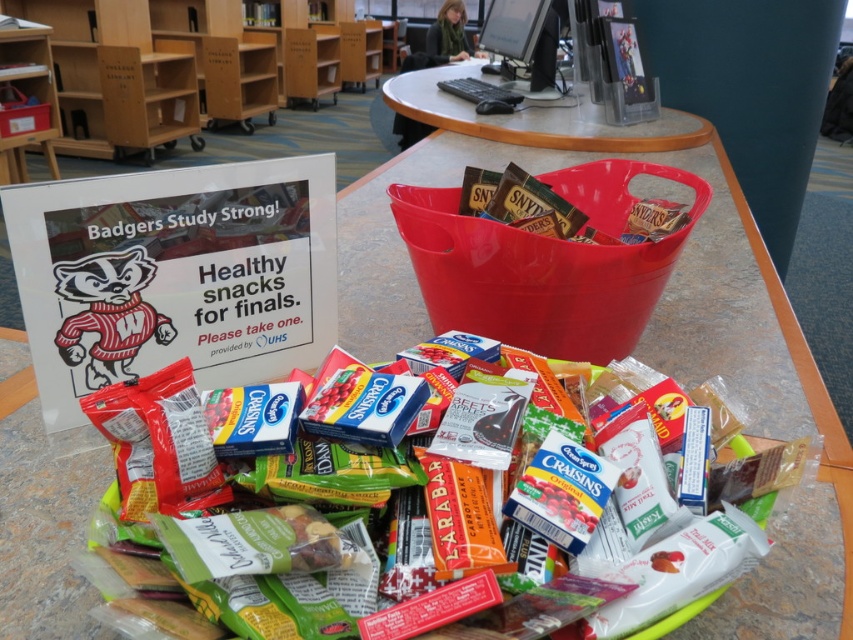
Question: Is light brown wood bookshelf at upper left further to camera compared to matte plastic bag of mixed snacks at center?

Choices:
 (A) no
 (B) yes

Answer: (B)

Question: Can you confirm if matte plastic bag of mixed snacks at center is bigger than wooden table at center?

Choices:
 (A) yes
 (B) no

Answer: (B)

Question: Where is matte plastic bag of mixed snacks at center located in relation to wooden table at center in the image?

Choices:
 (A) left
 (B) right

Answer: (A)

Question: Estimate the real-world distances between objects in this image. Which object is farther from the light brown wood bookshelf at upper left?

Choices:
 (A) wooden table at center
 (B) matte plastic bag of mixed snacks at center

Answer: (B)

Question: Among these objects, which one is nearest to the camera?

Choices:
 (A) light brown wood bookshelf at upper left
 (B) matte plastic bag of mixed snacks at center

Answer: (B)

Question: Which object is closer to the camera taking this photo?

Choices:
 (A) matte plastic bag of mixed snacks at center
 (B) light brown wood bookshelf at upper left

Answer: (A)